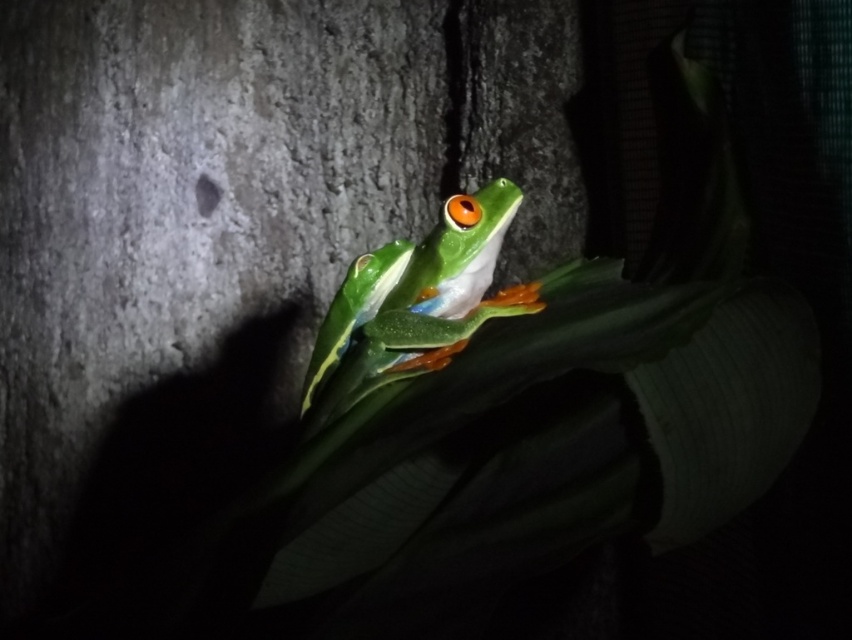
This screenshot has height=640, width=852. I want to click on rough bark tree trunk at center, so click(x=226, y=232).

Can you confirm if rough bark tree trunk at center is taller than green matte tree frog at center?

Indeed, rough bark tree trunk at center has a greater height compared to green matte tree frog at center.

Between point (45, 250) and point (488, 227), which one is positioned behind?

Point (45, 250)

Where is `rough bark tree trunk at center`? This screenshot has height=640, width=852. rough bark tree trunk at center is located at coordinates tap(226, 232).